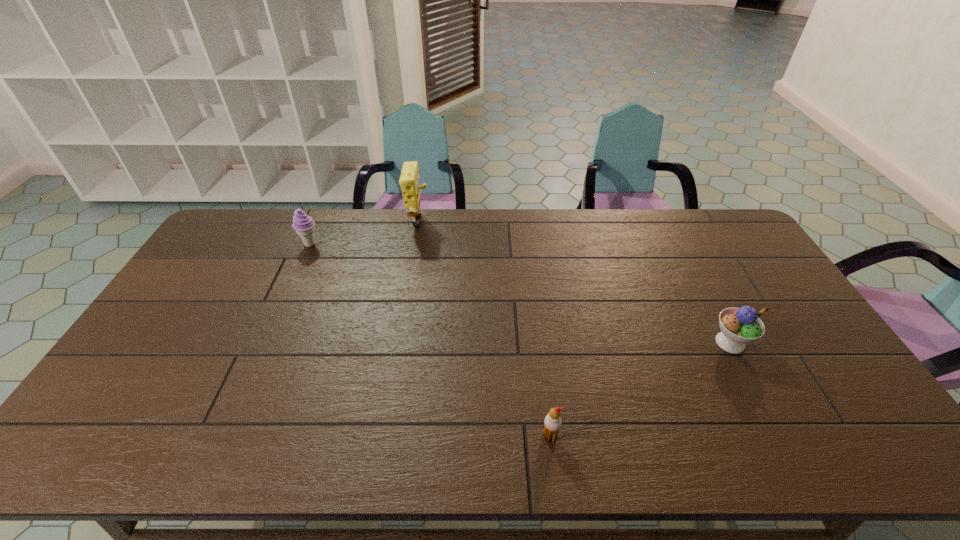
I want to click on free space between the leftmost icecream and the nearest object, so click(430, 340).

Locate an element on the screen. This screenshot has width=960, height=540. unoccupied area between the shortest icecream and the sponge is located at coordinates click(x=484, y=330).

Locate an element on the screen. vacant area that lies between the second farthest icecream and the leftmost object is located at coordinates (520, 293).

Where is `unoccupied position between the nearest icecream and the rightmost icecream`? unoccupied position between the nearest icecream and the rightmost icecream is located at coordinates (640, 389).

Locate an element on the screen. The height and width of the screenshot is (540, 960). vacant area that lies between the rightmost object and the leftmost object is located at coordinates (520, 293).

Image resolution: width=960 pixels, height=540 pixels. I want to click on vacant space that's between the second nearest icecream and the leftmost icecream, so click(x=520, y=293).

Where is `free spot between the leftmost icecream and the shortest object`? This screenshot has width=960, height=540. free spot between the leftmost icecream and the shortest object is located at coordinates (430, 340).

In order to click on vacant space that's between the leftmost object and the sponge in this screenshot , I will do `click(364, 234)`.

Locate an element on the screen. The image size is (960, 540). free space between the leftmost object and the tallest object is located at coordinates (364, 234).

Locate an element on the screen. object that is the second nearest to the leftmost icecream is located at coordinates (552, 423).